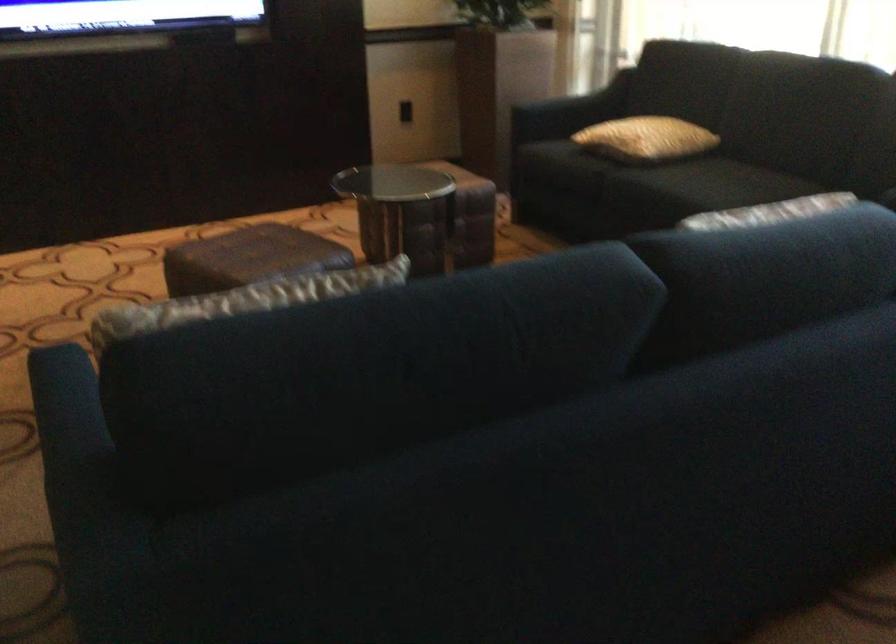
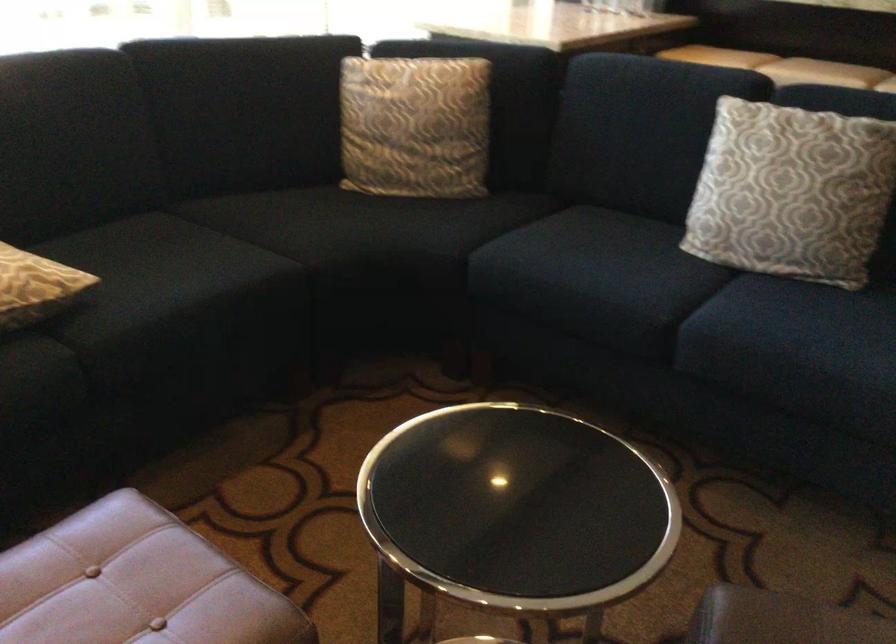
Find the pixel in the second image that matches the point at 698,176 in the first image.

(161, 270)